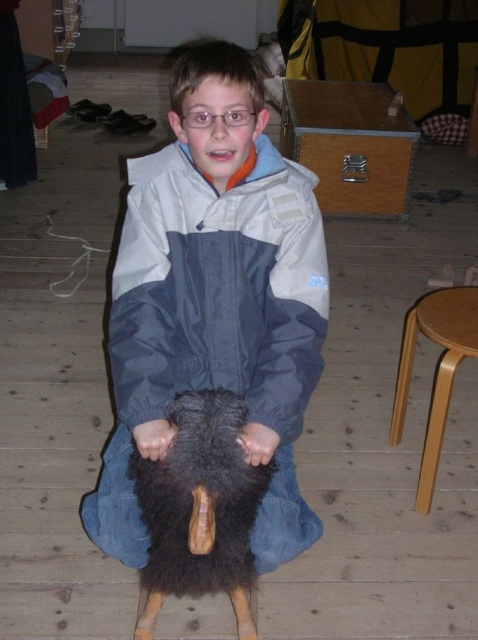
You are a photographer trying to capture the boy and his toys. You need to know the position of the dark gray fabric jacket at center and the fuzzy black animal at center to frame your shot. Which object is positioned to the right side in the image?

The dark gray fabric jacket at center is to the right of fuzzy black animal at center, so the dark gray fabric jacket at center is positioned to the right side in the image.

The boy is sitting on the wooden floor and has two items near him. One is the dark gray fabric jacket at center and the other is the fuzzy black animal at center. Which item is closer to the viewer?

The dark gray fabric jacket at center is closer to the viewer because the fuzzy black animal at center is behind it.

You are a toy designer who wants to create a storage box for the fuzzy black animal at center and the light brown wood stool at right. Which object requires a taller storage box?

The light brown wood stool at right requires a taller storage box because the fuzzy black animal at center is not as tall as it.